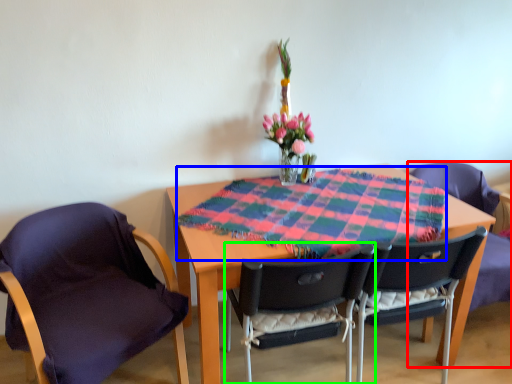
Question: Which is farther away from chair (highlighted by a red box)? blanket (highlighted by a blue box) or chair (highlighted by a green box)?

Choices:
 (A) blanket
 (B) chair

Answer: (B)